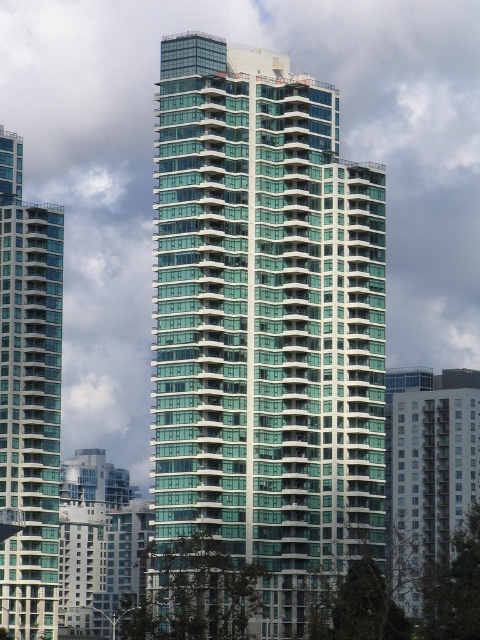
Looking at this image, which is more to the left, green glass building at center or glassy teal building at left?

glassy teal building at left is more to the left.

Measure the distance between point (207, 378) and camera.

Point (207, 378) and camera are 119.19 meters apart.

Is point (232, 86) farther from viewer compared to point (20, 621)?

No, it is in front of (20, 621).

Locate an element on the screen. This screenshot has height=640, width=480. green glass building at center is located at coordinates (265, 321).